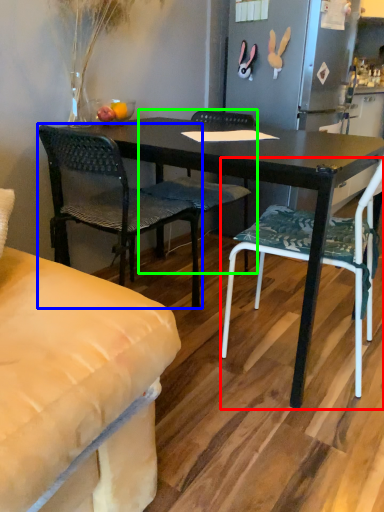
Question: Which object is positioned farthest from chair (highlighted by a red box)? Select from chair (highlighted by a blue box) and chair (highlighted by a green box).

Choices:
 (A) chair
 (B) chair

Answer: (A)